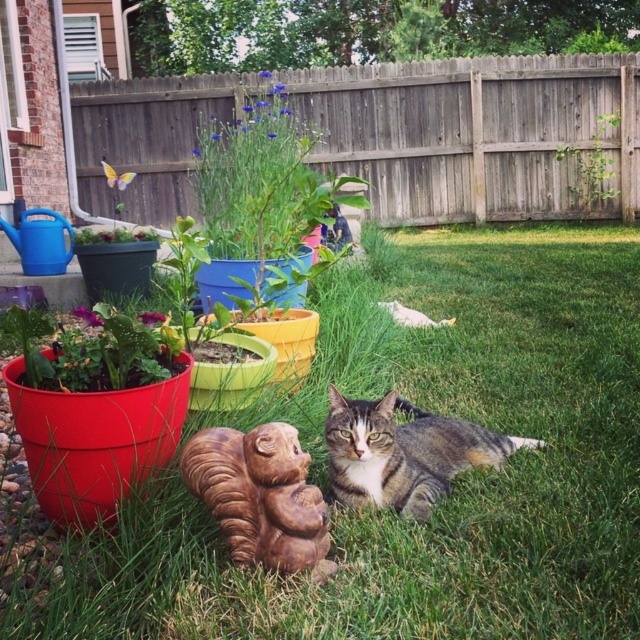
Question: Which of these objects is positioned farthest from the wooden fence at upper center?

Choices:
 (A) tabby fur cat at center
 (B) green leafy plant at upper center
 (C) green grass at center
 (D) white fur cat at center

Answer: (A)

Question: Which of the following is the farthest from the observer?

Choices:
 (A) (385, 397)
 (B) (397, 305)

Answer: (B)

Question: Which point appears closest to the camera in this image?

Choices:
 (A) (420, 257)
 (B) (388, 104)
 (C) (588, 208)
 (D) (381, 301)

Answer: (D)

Question: Does green leafy plant at upper center have a larger size compared to white fur cat at center?

Choices:
 (A) yes
 (B) no

Answer: (A)

Question: Is green grass at center in front of green leafy plant at upper center?

Choices:
 (A) yes
 (B) no

Answer: (A)

Question: Does green grass at center have a lesser width compared to tabby fur cat at center?

Choices:
 (A) yes
 (B) no

Answer: (B)